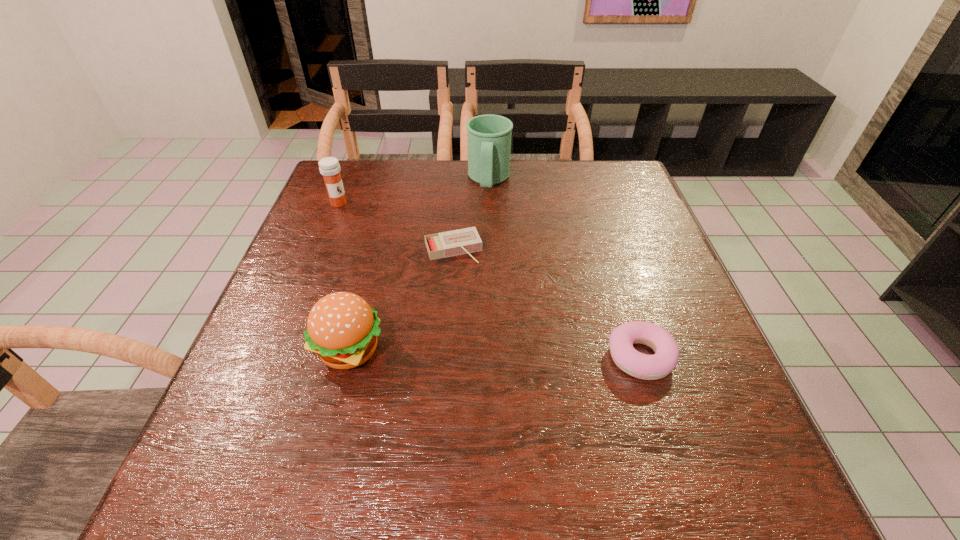
You are a GUI agent. You are given a task and a screenshot of the screen. Output one action in this format:
    pyautogui.click(x=<x>, y=<y>)
    Task: Click on the hamburger located in the left edge section of the desktop
    The width and height of the screenshot is (960, 540).
    Given the screenshot: What is the action you would take?
    pyautogui.click(x=342, y=328)

What are the coordinates of `medicine situated at the left edge` in the screenshot? It's located at (x=329, y=167).

Find the location of a particular element. The height and width of the screenshot is (540, 960). object located in the right edge section of the desktop is located at coordinates (647, 367).

The height and width of the screenshot is (540, 960). In order to click on object located at the far left corner in this screenshot , I will do `click(329, 167)`.

In the image, there is a desktop. Where is `free space at the far edge`? free space at the far edge is located at coordinates (444, 195).

Where is `free space at the near edge of the desktop`? free space at the near edge of the desktop is located at coordinates (592, 428).

Locate an element on the screen. Image resolution: width=960 pixels, height=540 pixels. vacant space at the left edge of the desktop is located at coordinates (x=267, y=352).

In order to click on free space at the right edge in this screenshot , I will do `click(616, 217)`.

This screenshot has height=540, width=960. I want to click on free location at the far left corner, so click(350, 172).

The image size is (960, 540). I want to click on free space at the far right corner of the desktop, so click(621, 199).